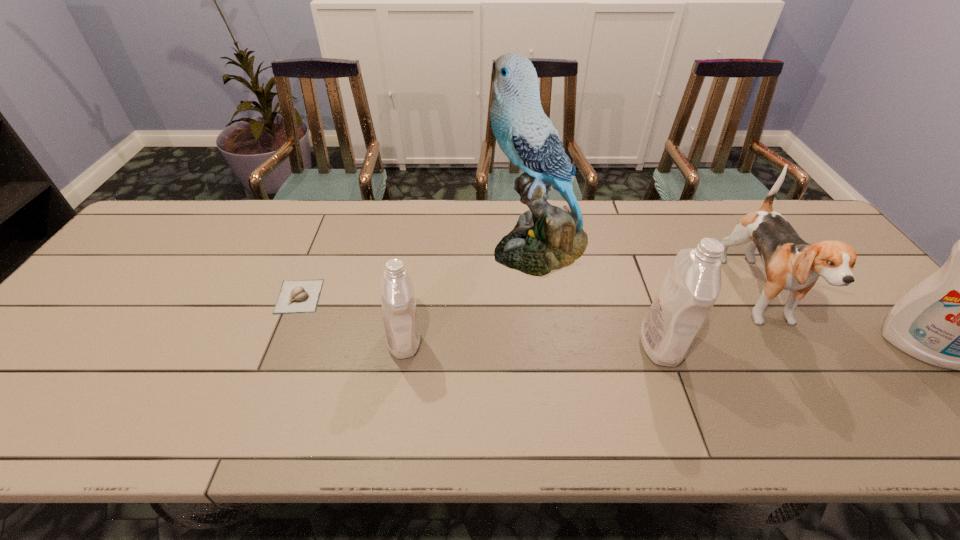
Locate an element on the screen. vacant space located on the right of the second shortest detergent is located at coordinates (843, 344).

You are a GUI agent. You are given a task and a screenshot of the screen. Output one action in this format:
    pyautogui.click(x=<x>, y=<y>)
    Task: Click on the free space located on the face of the parakeet
    
    Given the screenshot: What is the action you would take?
    pyautogui.click(x=403, y=247)

Where is `vacant space situated on the face of the parakeet`? The width and height of the screenshot is (960, 540). vacant space situated on the face of the parakeet is located at coordinates click(x=423, y=247).

What are the coordinates of `free spot located on the face of the parakeet` in the screenshot? It's located at [383, 247].

The width and height of the screenshot is (960, 540). What are the coordinates of `free space located on the left of the shortest object` in the screenshot? It's located at (149, 296).

Find the location of a particular element. vacant area situated at the face of the fifth object from left to right is located at coordinates (823, 400).

The height and width of the screenshot is (540, 960). What are the coordinates of `object that is at the far edge` in the screenshot? It's located at (546, 238).

Image resolution: width=960 pixels, height=540 pixels. In order to click on object present at the near edge in this screenshot , I will do `click(692, 284)`.

In the image, there is a desktop. At what (x,y) coordinates should I click in order to perform the action: click on vacant space at the far edge. Please return your answer as a coordinate pair (x, y). Looking at the image, I should click on (612, 213).

This screenshot has height=540, width=960. Identify the location of vacant region at the near edge. (277, 389).